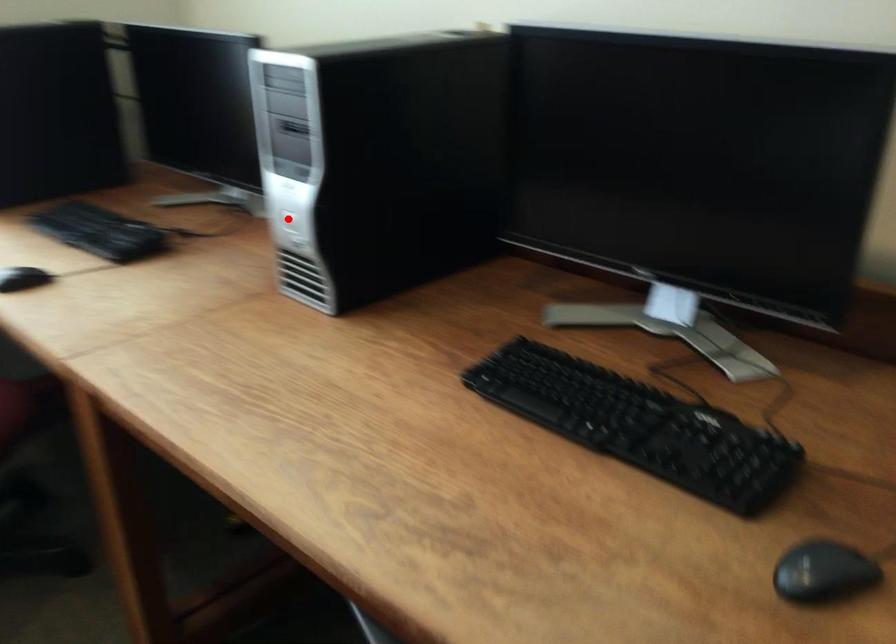
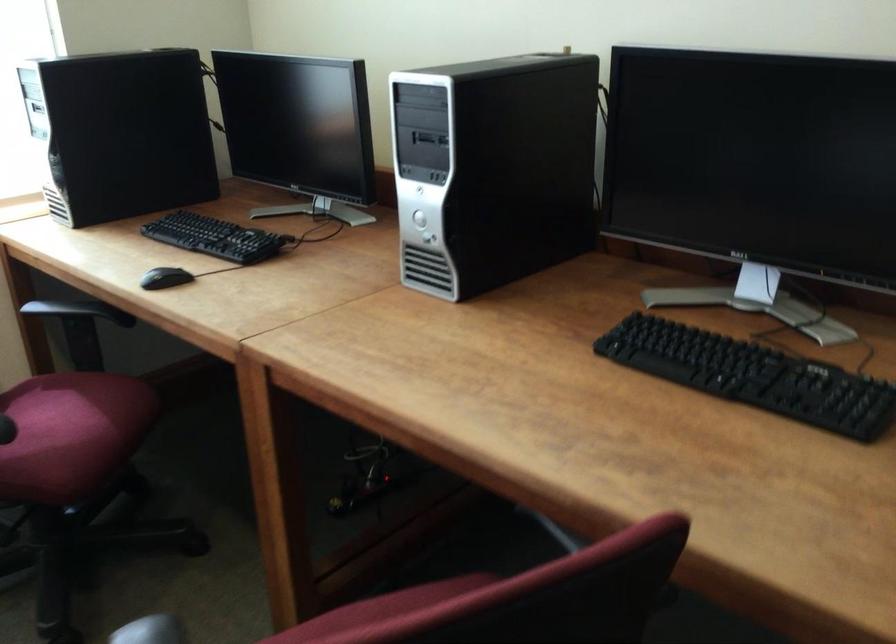
Question: I am providing you with two images of the same scene from different viewpoints. Given a red point in image1, look at the same physical point in image2. Is it:

Choices:
 (A) Closer to the viewpoint
 (B) Farther from the viewpoint

Answer: (B)